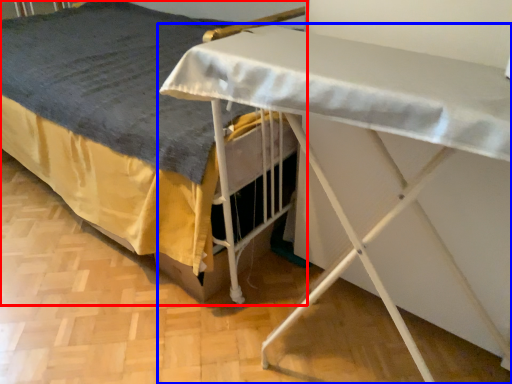
Question: Which object is closer to the camera taking this photo, bed (highlighted by a red box) or table (highlighted by a blue box)?

Choices:
 (A) bed
 (B) table

Answer: (B)